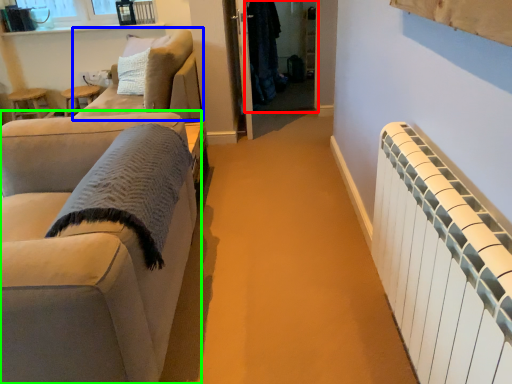
Question: Which is farther away from glass door (highlighted by a red box)? studio couch (highlighted by a blue box) or studio couch (highlighted by a green box)?

Choices:
 (A) studio couch
 (B) studio couch

Answer: (B)